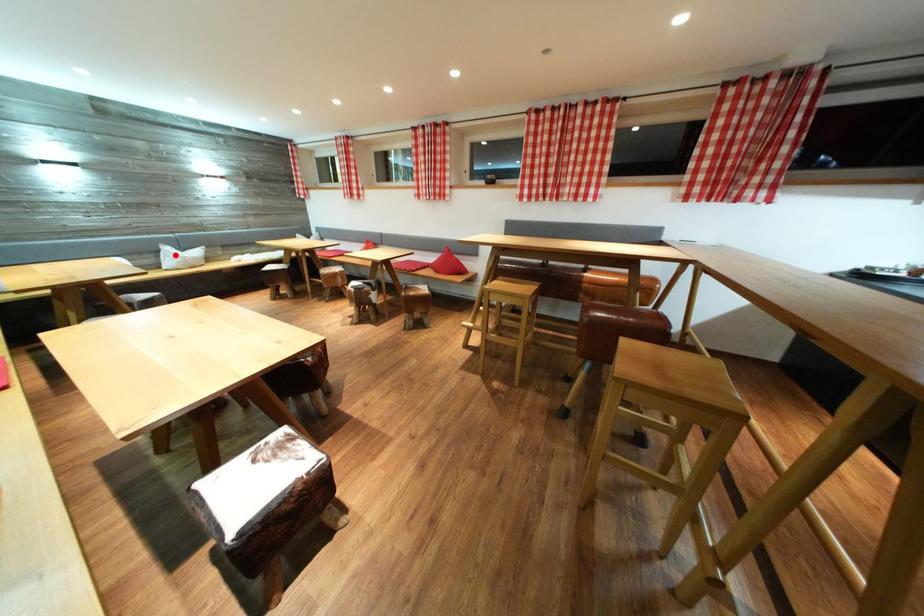
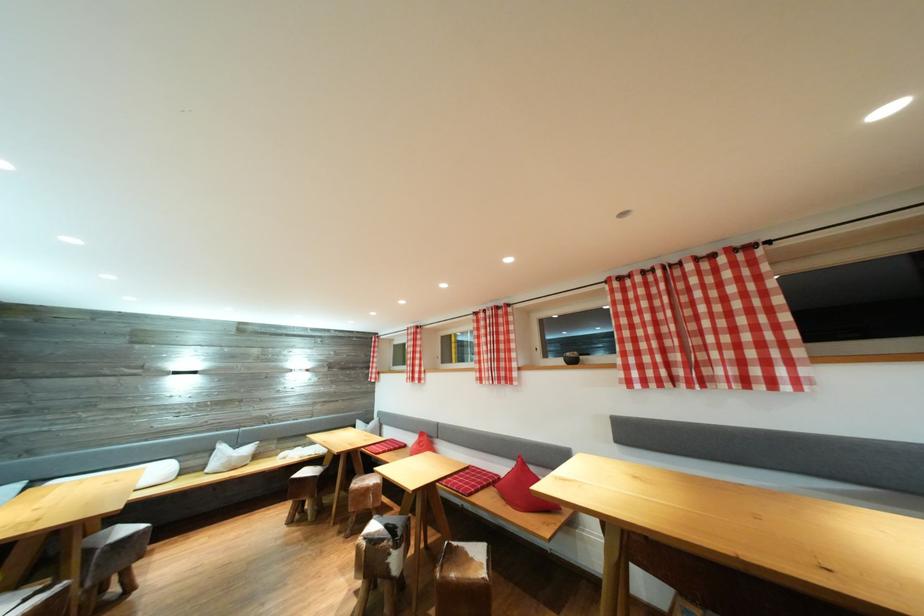
Locate, in the second image, the point that corresponds to the highlighted location in the first image.

(228, 453)